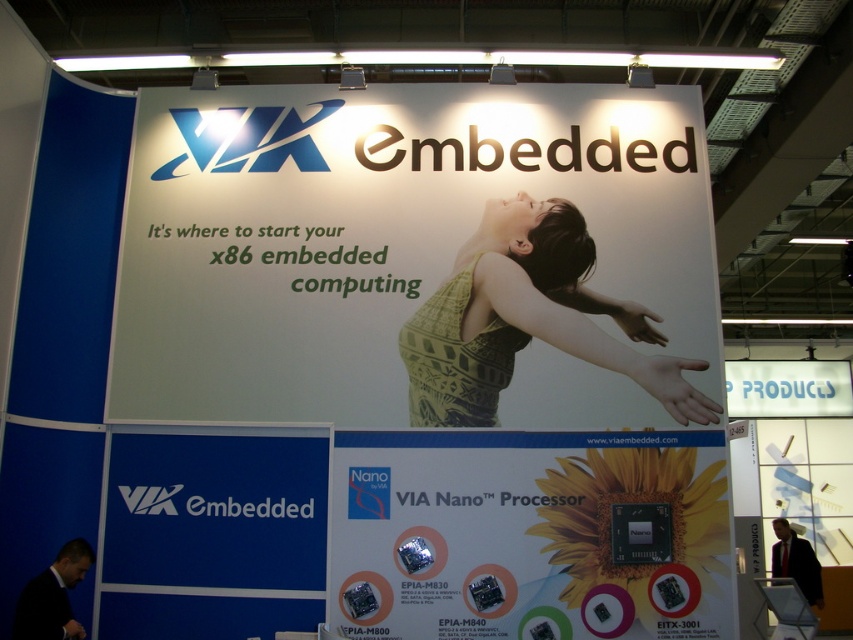
From the picture: You are attending a trade show and want to read the information on both the white paper billboard at center and the green knitted tank top at center. Which one is located to the left of the other?

The white paper billboard at center is positioned on the left side of green knitted tank top at center.

You are standing in front of the booth and want to read the text on the white paper billboard at center. Where should you look?

The white paper billboard at center is located at the 2D coordinates point (415, 257), so you should look towards the center of the booth to read the text on the white paper billboard at center.

You are an attendee at the exhibition and want to read the information on both the white paper billboard at center and the green knitted tank top at center. Which one do you need to step closer to in order to read the text clearly?

The green knitted tank top at center is smaller than the white paper billboard at center, so you need to step closer to the green knitted tank top at center to read its text clearly.